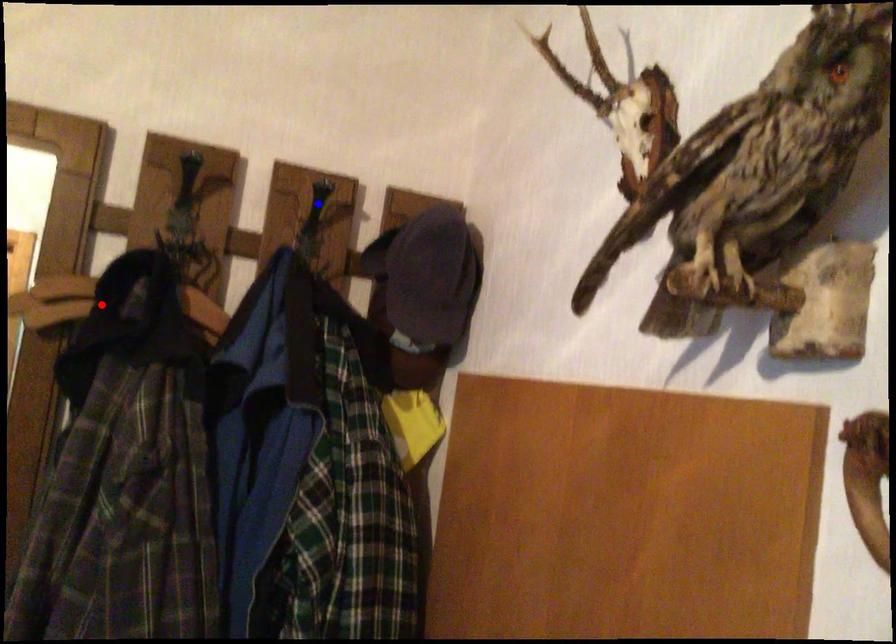
Question: Which of the two points in the image is closer to the camera?

Choices:
 (A) Blue point is closer.
 (B) Red point is closer.

Answer: (B)